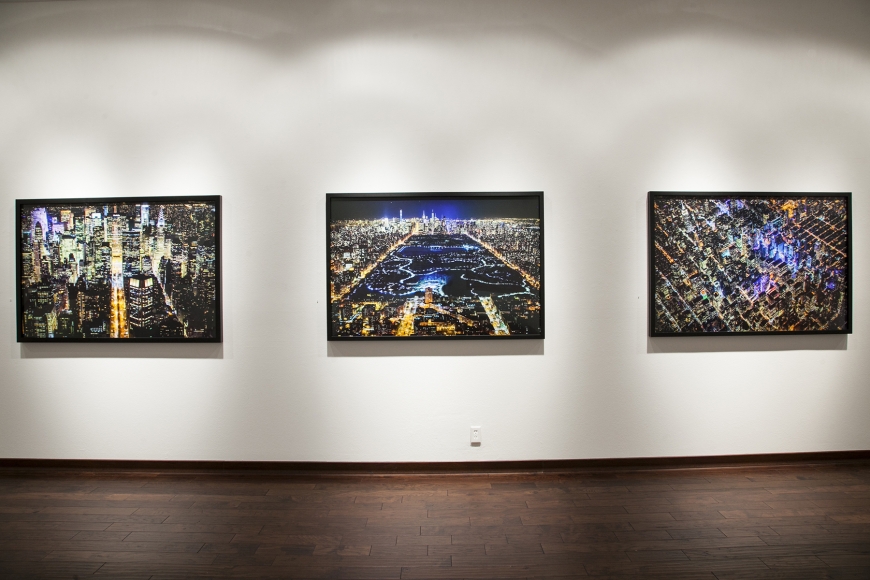
Find the location of a particular element. socket is located at coordinates (467, 434).